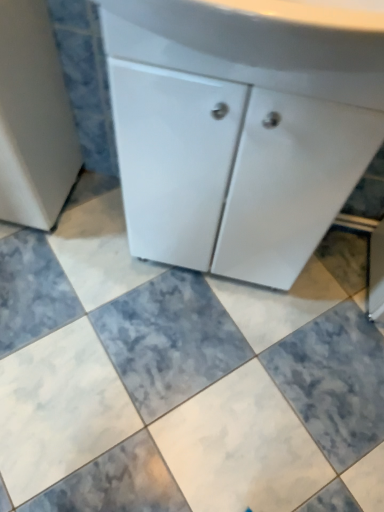
You are a GUI agent. You are given a task and a screenshot of the screen. Output one action in this format:
    pyautogui.click(x=<x>, y=<y>)
    Task: Click on the free space to the left of white glossy cabinet at center
    The width and height of the screenshot is (384, 512).
    Given the screenshot: What is the action you would take?
    pyautogui.click(x=85, y=252)